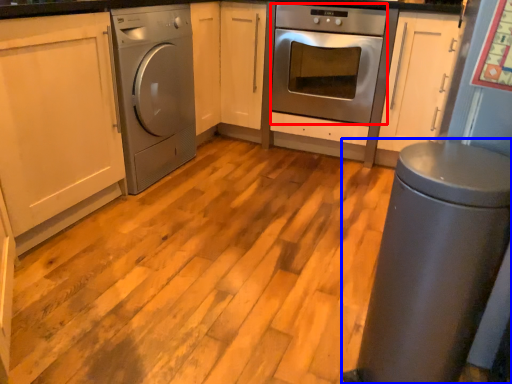
Question: Which point is further to the camera, oven (highlighted by a red box) or gray (highlighted by a blue box)?

Choices:
 (A) oven
 (B) gray

Answer: (A)